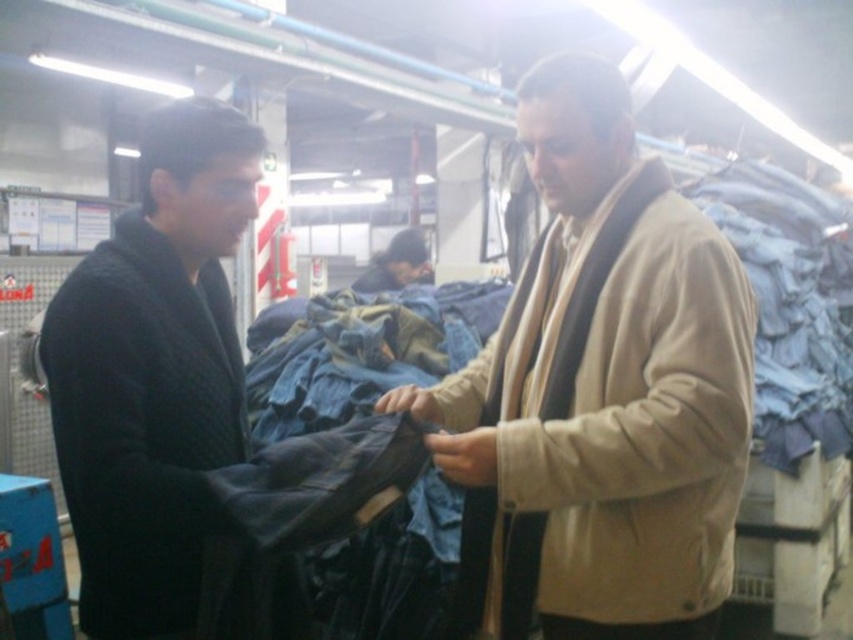
Can you confirm if beige fabric jacket at center is smaller than dark blue denim jacket at center?

No, beige fabric jacket at center is not smaller than dark blue denim jacket at center.

Which is behind, point (630, 284) or point (404, 248)?

The point (404, 248) is more distant.

Locate an element on the screen. beige fabric jacket at center is located at coordinates (601, 394).

Can you confirm if beige fabric jacket at center is shorter than black woolen sweater at left?

No.

Between point (692, 532) and point (102, 337), which one is positioned in front?

Positioned in front is point (102, 337).

Is point (434, 458) farther from camera compared to point (103, 614)?

That is True.

Where is `beige fabric jacket at center`? Image resolution: width=853 pixels, height=640 pixels. beige fabric jacket at center is located at coordinates (601, 394).

Is black woolen sweater at left thinner than dark blue denim jacket at center?

Yes.

Is point (235, 436) in front of point (412, 250)?

Yes, point (235, 436) is in front of point (412, 250).

Does point (68, 406) come closer to viewer compared to point (397, 253)?

Yes, it is.

You are a GUI agent. You are given a task and a screenshot of the screen. Output one action in this format:
    pyautogui.click(x=<x>, y=<y>)
    Task: Click on the black woolen sweater at left
    Image resolution: width=853 pixels, height=640 pixels.
    Given the screenshot: What is the action you would take?
    pyautogui.click(x=141, y=426)